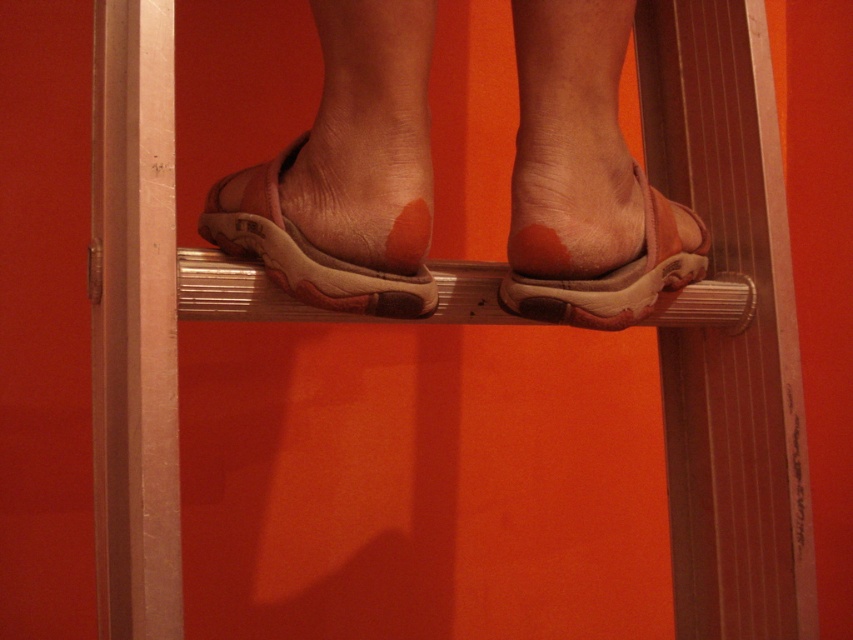
Does leather sandals at center appear under leather sandal at center?

No, leather sandals at center is not below leather sandal at center.

Can you confirm if leather sandals at center is wider than leather sandal at center?

Yes.

Locate an element on the screen. leather sandals at center is located at coordinates (347, 173).

Can you confirm if leather sandal at center is taller than brown suede sandal at center?

Yes.

In the scene shown: Who is higher up, leather sandal at center or brown suede sandal at center?

leather sandal at center is higher up.

Is point (248, 225) positioned after point (642, 253)?

No, it is in front of (642, 253).

At what (x,y) coordinates should I click in order to perform the action: click on leather sandal at center. Please return your answer as a coordinate pair (x, y). This screenshot has height=640, width=853. Looking at the image, I should click on (306, 252).

Which is more to the right, leather sandals at center or brown suede sandal at center?

brown suede sandal at center is more to the right.

Who is more distant from viewer, (380,10) or (683,212)?

Positioned behind is point (683,212).

I want to click on leather sandals at center, so click(x=347, y=173).